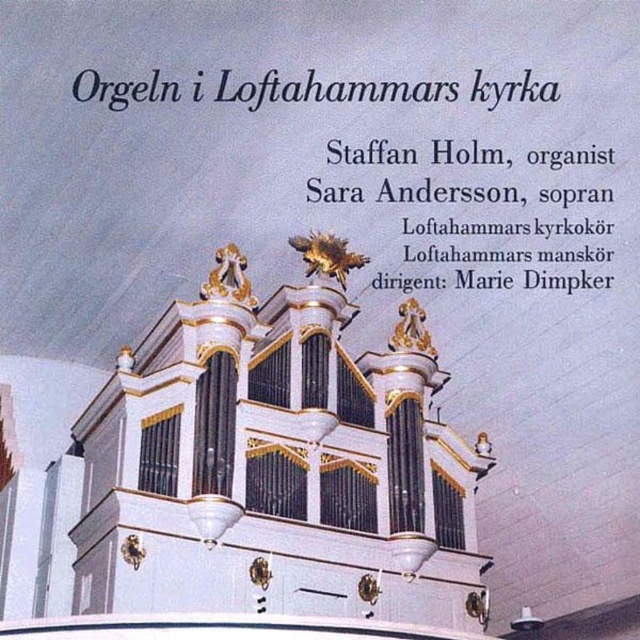
You are an interior designer planning to place a new decorative item in the church. You have a small golden angel statue that is the same size as the white paper at upper center. You want to place it next to the white polished wood organ at center. Will the statue fit in the space next to the organ without overlapping?

The white polished wood organ at center is bigger than the white paper at upper center. Since the statue is the same size as the white paper at upper center, it should fit next to the organ without overlapping, as the organ provides ample space.